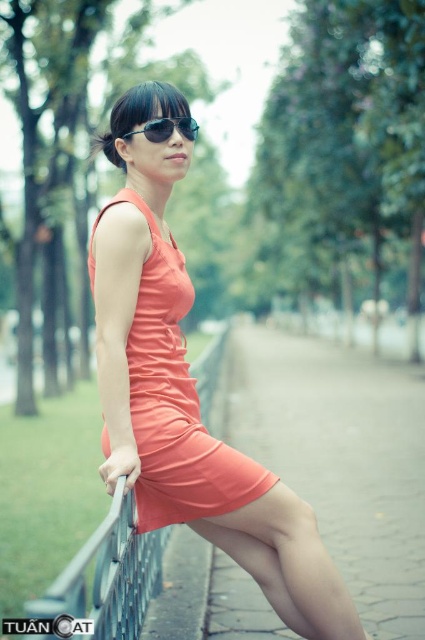
Which is below, coral satin dress at center or black reflective sunglasses at center?

coral satin dress at center is below.

Is point (139, 486) more distant than point (149, 124)?

Yes, it is behind point (149, 124).

Image resolution: width=425 pixels, height=640 pixels. What do you see at coordinates (173, 401) in the screenshot?
I see `coral satin dress at center` at bounding box center [173, 401].

Find the location of `coral satin dress at center`. coral satin dress at center is located at coordinates [173, 401].

Which is in front, point (260, 499) or point (175, 490)?

Point (260, 499)

Can you confirm if matte orange dress at center is bigger than coral satin dress at center?

Yes.

You are a GUI agent. You are given a task and a screenshot of the screen. Output one action in this format:
    pyautogui.click(x=<x>, y=<y>)
    Task: Click on the matte orange dress at center
    This screenshot has width=425, height=640.
    Given the screenshot: What is the action you would take?
    pyautogui.click(x=187, y=392)

Find the location of a particular element. This screenshot has width=425, height=640. matte orange dress at center is located at coordinates (187, 392).

Which of these two, coral satin dress at center or metallic gray fence at lower left, stands taller?

Standing taller between the two is coral satin dress at center.

Is point (229, 472) positioned in front of point (113, 584)?

No, it is behind (113, 584).

Where is `coral satin dress at center`? coral satin dress at center is located at coordinates (173, 401).